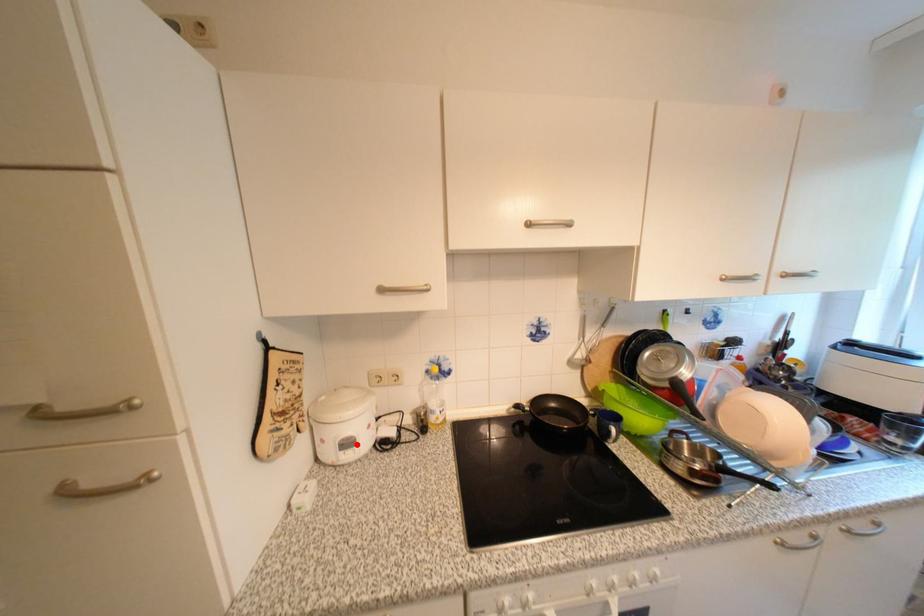
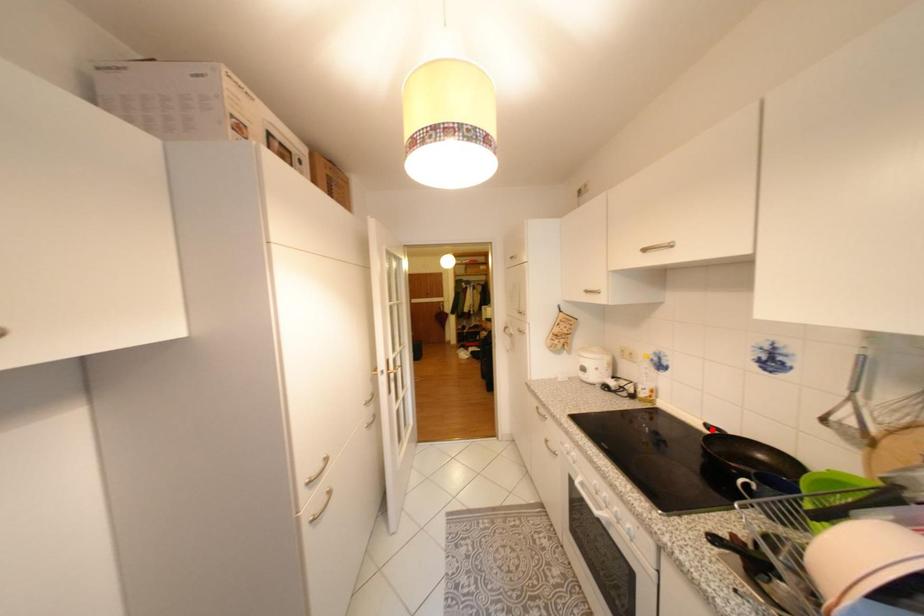
I am providing you with two images of the same scene from different viewpoints. A red point is marked on the first image and another point is marked on the second image. Does the point marked in image1 correspond to the same location as the one in image2?

No